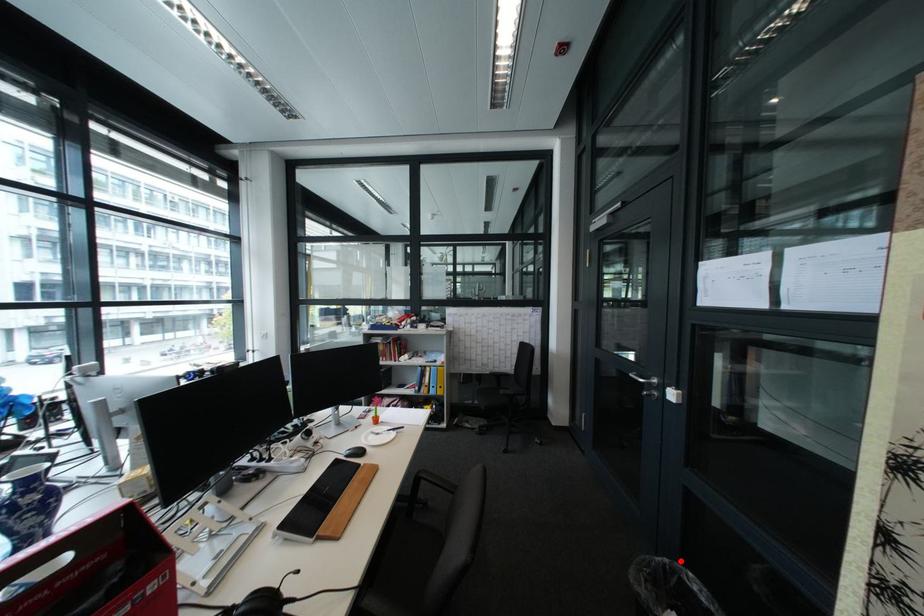
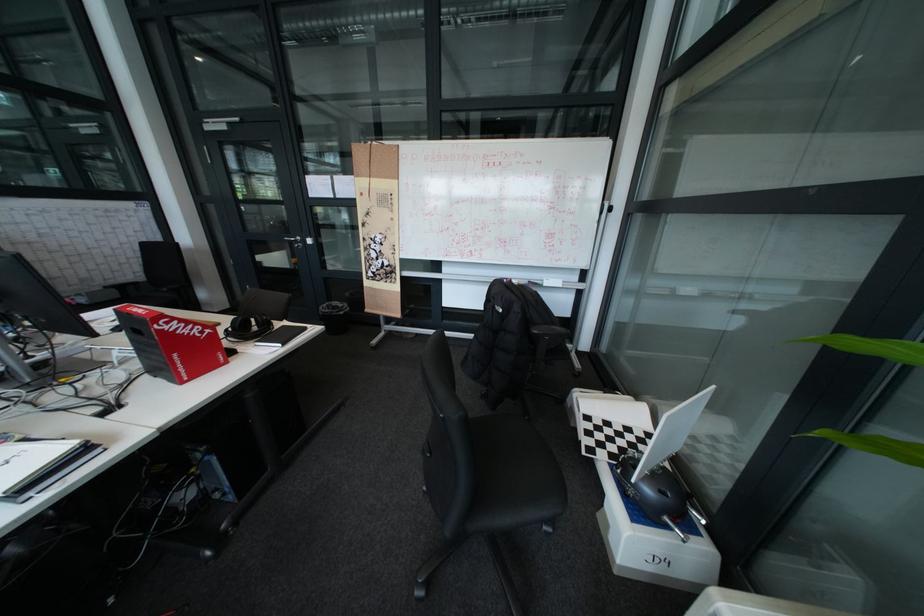
Question: I am providing you with two images of the same scene from different viewpoints. A red point is shown in image1. For the corresponding object point in image2, is it positioned nearer or farther from the camera?

Choices:
 (A) Nearer
 (B) Farther

Answer: (B)